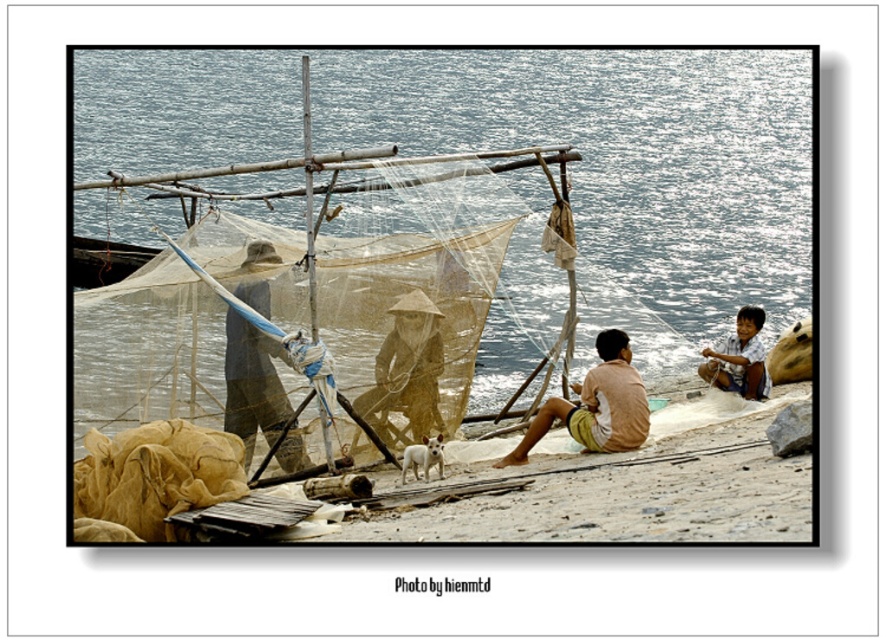
Does point (440, 310) lie behind point (616, 390)?

No, it is in front of (616, 390).

Between brown woven hat at center and light brown woven shorts at center, which one is positioned higher?

Positioned higher is brown woven hat at center.

At what (x,y) coordinates should I click in order to perform the action: click on brown woven hat at center. Please return your answer as a coordinate pair (x, y). Image resolution: width=886 pixels, height=640 pixels. Looking at the image, I should click on (406, 372).

Identify the location of brown woven hat at center. Image resolution: width=886 pixels, height=640 pixels. (406, 372).

Find the location of a particular element. matte blue fishing net at center is located at coordinates (258, 394).

Who is positioned more to the left, matte blue fishing net at center or light brown woven shorts at center?

matte blue fishing net at center

Who is more forward, (235, 429) or (642, 413)?

Point (235, 429) is more forward.

At what (x,y) coordinates should I click in order to perform the action: click on matte blue fishing net at center. Please return your answer as a coordinate pair (x, y). The height and width of the screenshot is (640, 886). Looking at the image, I should click on (258, 394).

Can you confirm if matte blue fishing net at center is bigger than brown woven hat at center?

Actually, matte blue fishing net at center might be smaller than brown woven hat at center.

Between matte blue fishing net at center and brown woven hat at center, which one is positioned lower?

brown woven hat at center is below.

Is point (253, 435) behind point (403, 355)?

No, it is not.

Where is `matte blue fishing net at center`? The width and height of the screenshot is (886, 640). matte blue fishing net at center is located at coordinates (258, 394).